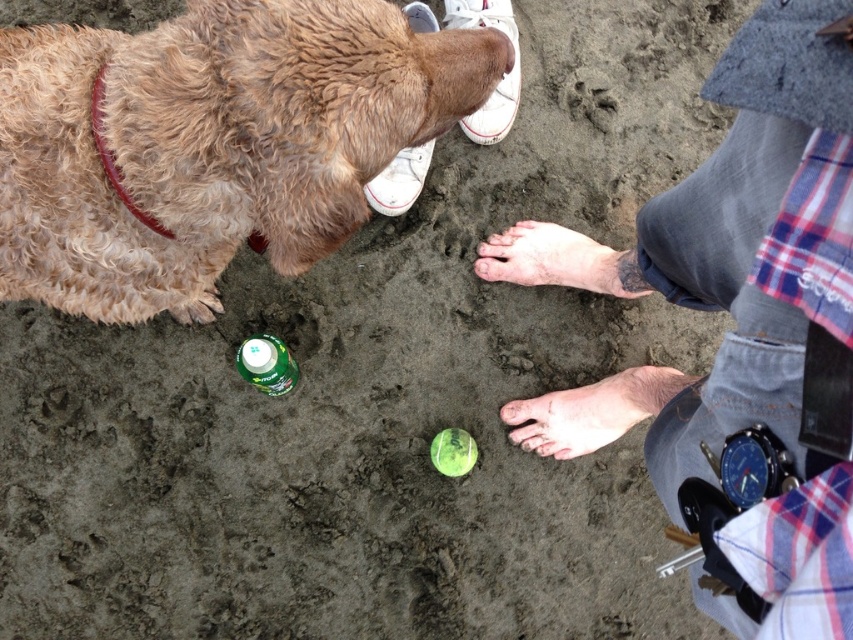
You are a dog owner who wants to ensure your curly fur dog at upper left can reach the tennis ball located near the green bottle. Given the distance between the dog and the skinny barefoot at lower center, can the dog comfortably reach the tennis ball without crossing that distance?

The distance between the curly fur dog at upper left and the skinny barefoot at lower center is 36.16 inches. Since the tennis ball is near the green bottle, which is in the middle ground, the dog would need to move closer to the tennis ball. However, the question mentions avoiding crossing the distance to the skinny barefoot. Without exact positioning details of the tennis ball relative to the dog and the foot, it is unclear if the path to the ball requires crossing that 36.16 inch gap. More information is

You are a photographer trying to capture the brown leather collar at upper left and the skinny barefoot at lower center in the same frame. Since you want to emphasize both objects equally, which one should you zoom in on more, and why?

→ You should zoom in more on the brown leather collar at upper left because it is smaller in size compared to the skinny barefoot at lower center. This will help balance their sizes in the photo so both are emphasized equally.

You are standing on the beach and see the curly fur dog at upper left and the pale skin barefoot at center. Which object is taller?

The curly fur dog at upper left is taller than the pale skin barefoot at center.